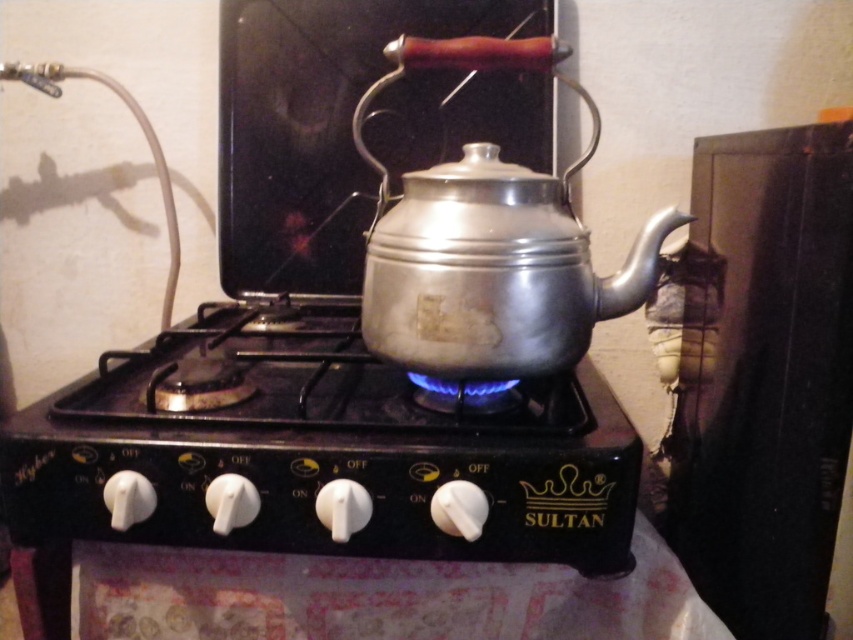
You are a chef preparing to move the shiny metallic kettle at center to the counter behind you. Can you lift the kettle directly without moving the black matte stove at center first?

The black matte stove at center is in front of the shiny metallic kettle at center, so you cannot lift the kettle directly without moving the stove first.

You are a chef preparing to boil water for tea. You have a silver metallic teapot at center and a shiny metallic kettle at center on the stove. Which one is closer to the edge of the stove surface?

The silver metallic teapot at center and shiny metallic kettle at center are 5.34 inches apart, but the exact distance from the edge isn answerable with the given information.

You are setting up a kitchen and need to ensure that the black matte stove at center can fit under a low cabinet. The cabinet has a height clearance of 60 cm. Given that the silver metallic teapot at center is taller than the stove, can you determine if the stove will fit under the cabinet?

The black matte stove at center has a lesser height compared to the silver metallic teapot at center. Since the teapot is taller than the stove and the cabinet has a 60 cm clearance, the stove should fit under the cabinet provided the teapot can fit vertically within that space. However, without knowing the exact height of the teapot, we cannot confirm definitively. If the teapot is under 60 cm, the stove likely fits.